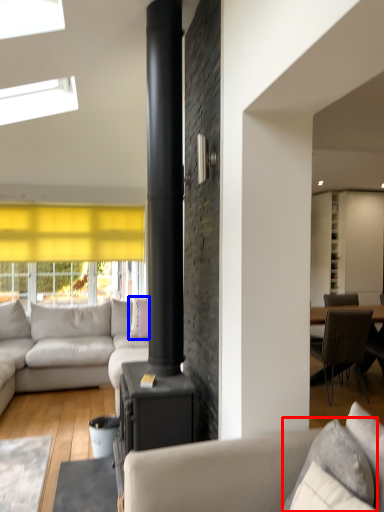
Question: Which object is closer to the camera taking this photo, pillow (highlighted by a red box) or pillow (highlighted by a blue box)?

Choices:
 (A) pillow
 (B) pillow

Answer: (A)